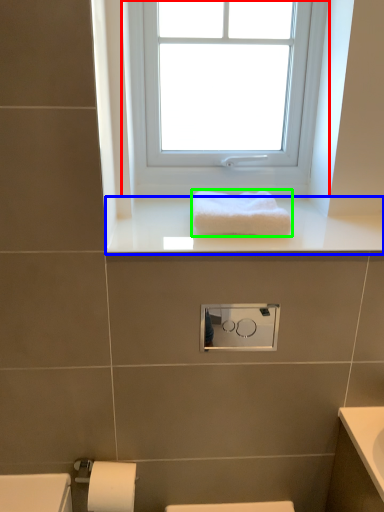
Question: Which is nearer to the window (highlighted by a red box)? window sill (highlighted by a blue box) or towel (highlighted by a green box).

Choices:
 (A) window sill
 (B) towel

Answer: (A)